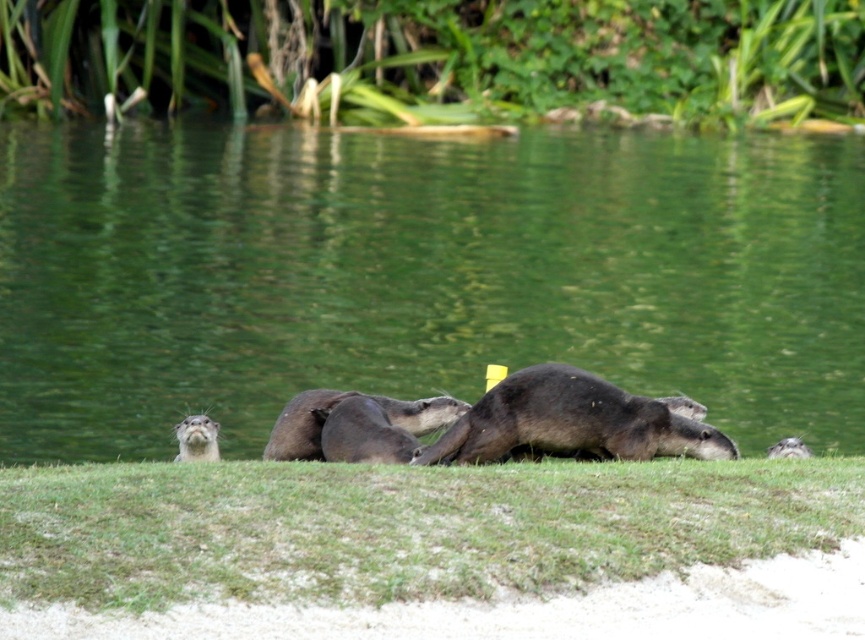
Question: Which point is farther to the camera?

Choices:
 (A) soft brown otter at center
 (B) green grass at lower center
 (C) dark brown fur otter at center
 (D) brown fur otter at center

Answer: (D)

Question: Which of the following is the closest to the observer?

Choices:
 (A) green grass at lower center
 (B) soft brown otter at center
 (C) brown fur otter at center

Answer: (A)

Question: Which point is farther to the camera?

Choices:
 (A) (195, 435)
 (B) (434, 403)
 (C) (561, 586)
 (D) (366, 134)

Answer: (D)

Question: Does green grass at lower center have a smaller size compared to brown fur otter at center?

Choices:
 (A) no
 (B) yes

Answer: (A)

Question: Is dark brown fur otter at center closer to camera compared to soft brown otter at center?

Choices:
 (A) no
 (B) yes

Answer: (B)

Question: In this image, where is green water at center located relative to soft brown otter at center?

Choices:
 (A) right
 (B) left

Answer: (B)